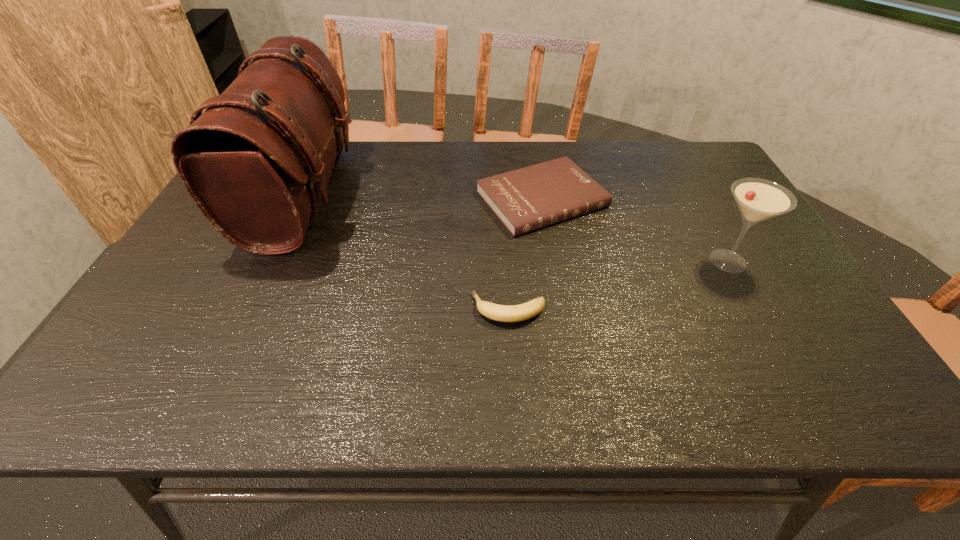
What are the coordinates of `vacant space that satisfies the following two spatial constraints: 1. on the front-facing side of the third shortest object; 2. on the right side of the tallest object` in the screenshot? It's located at (272, 261).

The height and width of the screenshot is (540, 960). In order to click on blank area in the image that satisfies the following two spatial constraints: 1. on the front-facing side of the satchel; 2. on the back side of the second tallest object in this screenshot , I will do `click(272, 261)`.